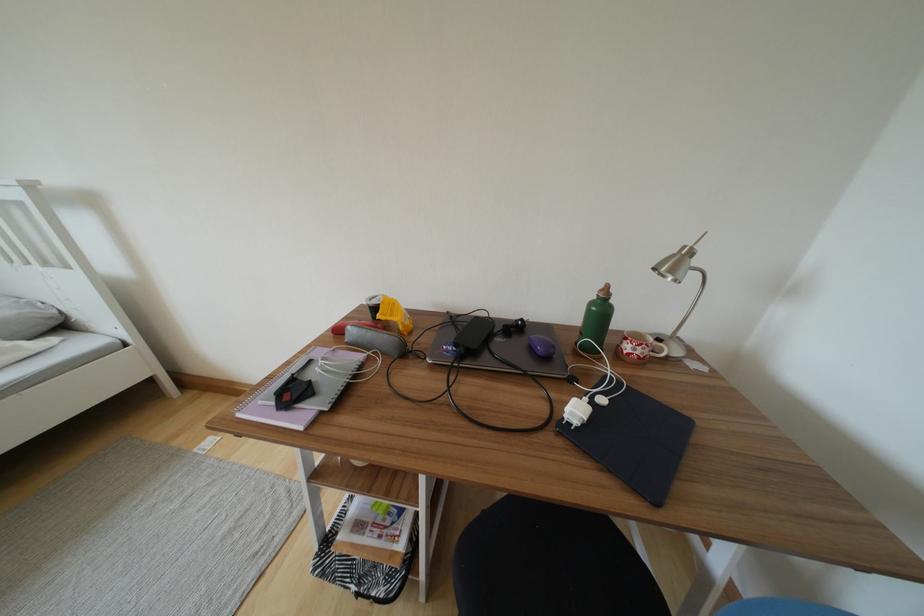
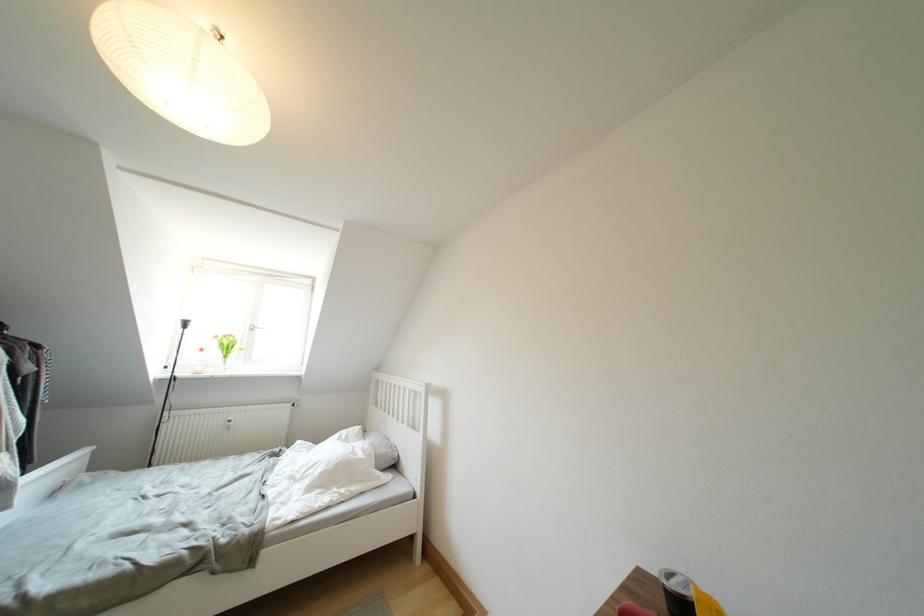
First-person continuous shooting, in which direction is the camera rotating?

The camera's rotation is toward left-up.